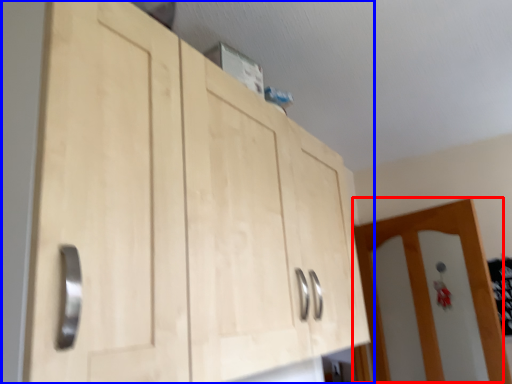
Question: Which object is closer to the camera taking this photo, door (highlighted by a red box) or cupboard (highlighted by a blue box)?

Choices:
 (A) door
 (B) cupboard

Answer: (B)